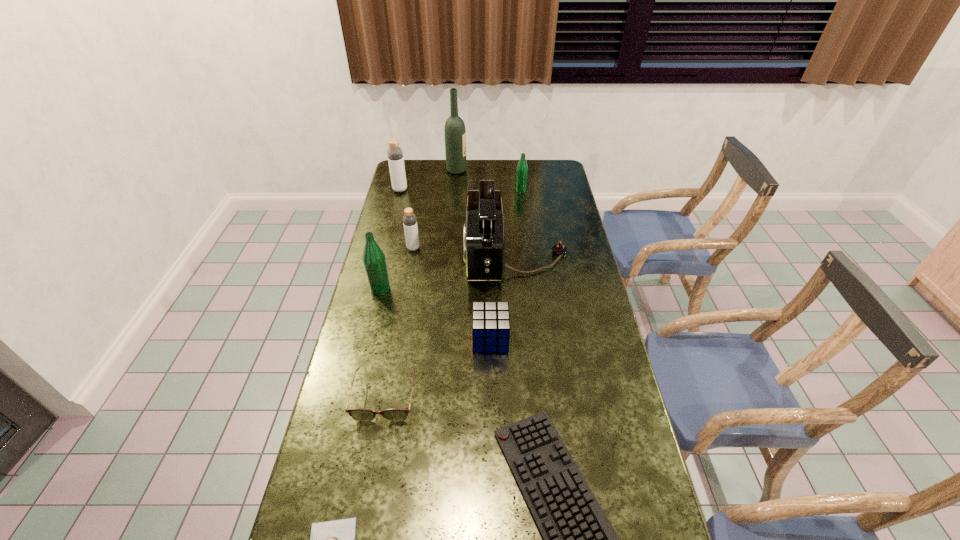
Locate an element on the screen. Image resolution: width=960 pixels, height=540 pixels. free point at the right edge is located at coordinates (549, 249).

The image size is (960, 540). In the image, there is a desktop. Find the location of `vacant space at the far left corner`. vacant space at the far left corner is located at coordinates (406, 160).

Identify the location of free point between the eighth tallest object and the nearer green bottle. (382, 343).

Identify the location of free area in between the left green bottle and the right gray bottle. This screenshot has height=540, width=960. (396, 268).

What are the coordinates of `free point between the second nearest bottle and the nearer green bottle` in the screenshot? It's located at (396, 268).

Where is `vacant space that's between the smaller green bottle and the radio receiver`? This screenshot has width=960, height=540. vacant space that's between the smaller green bottle and the radio receiver is located at coordinates (518, 222).

Locate which object ranks third in proximity to the bigger gray bottle. Please provide its 2D coordinates. Your answer should be formatted as a tuple, i.e. [(x, y)], where the tuple contains the x and y coordinates of a point satisfying the conditions above.

[(483, 242)]

Identify which object is located as the second nearest to the third bottle from left to right. Please provide its 2D coordinates. Your answer should be formatted as a tuple, i.e. [(x, y)], where the tuple contains the x and y coordinates of a point satisfying the conditions above.

[(483, 242)]

You are a GUI agent. You are given a task and a screenshot of the screen. Output one action in this format:
    pyautogui.click(x=<x>, y=<y>)
    Task: Click on the bottle identified as the fourth closest to the spectacles
    The width and height of the screenshot is (960, 540).
    Given the screenshot: What is the action you would take?
    pyautogui.click(x=522, y=168)

Point out which bottle is positioned as the third nearest to the third bottle from left to right. Please provide its 2D coordinates. Your answer should be formatted as a tuple, i.e. [(x, y)], where the tuple contains the x and y coordinates of a point satisfying the conditions above.

[(522, 168)]